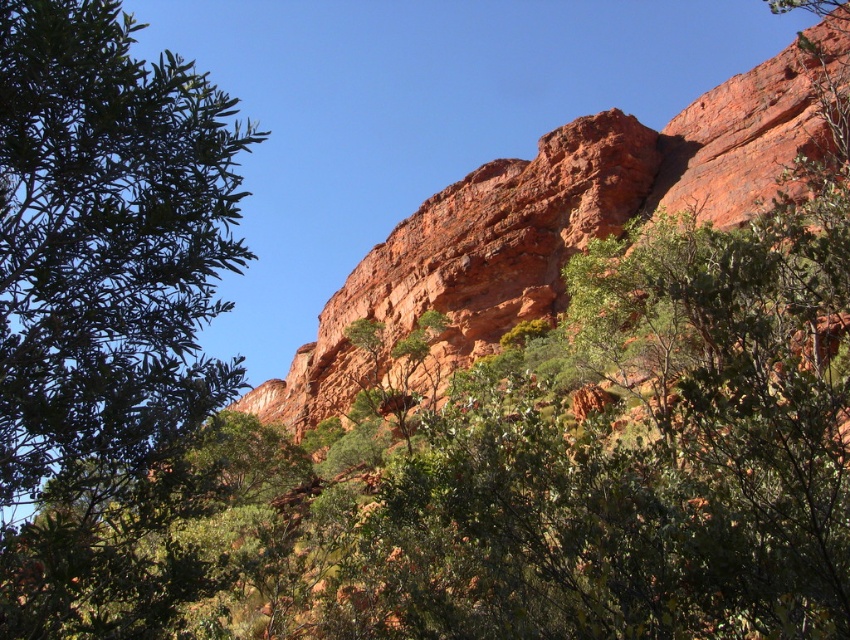
Question: Is green leafy tree at left smaller than reddish-brown rock at upper center?

Choices:
 (A) no
 (B) yes

Answer: (B)

Question: Which point is closer to the camera taking this photo?

Choices:
 (A) (129, 179)
 (B) (514, 275)

Answer: (A)

Question: Which point appears closest to the camera in this image?

Choices:
 (A) (241, 241)
 (B) (593, 148)

Answer: (A)

Question: Which point is farther to the camera?

Choices:
 (A) reddish-brown rock at upper center
 (B) green leafy tree at left

Answer: (A)

Question: From the image, what is the correct spatial relationship of green leafy tree at left in relation to reddish-brown rock at upper center?

Choices:
 (A) left
 (B) right

Answer: (A)

Question: Does green leafy tree at left have a larger size compared to reddish-brown rock at upper center?

Choices:
 (A) no
 (B) yes

Answer: (A)